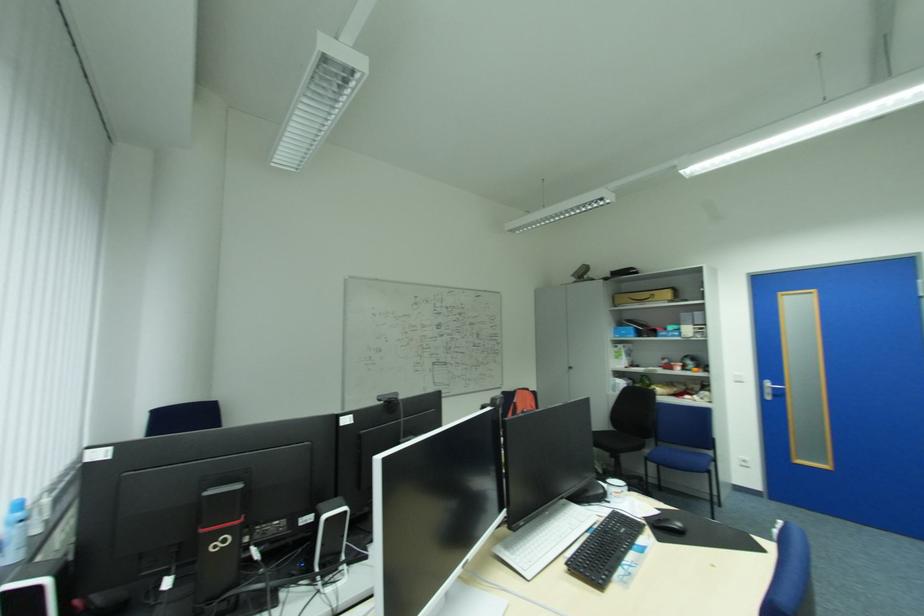
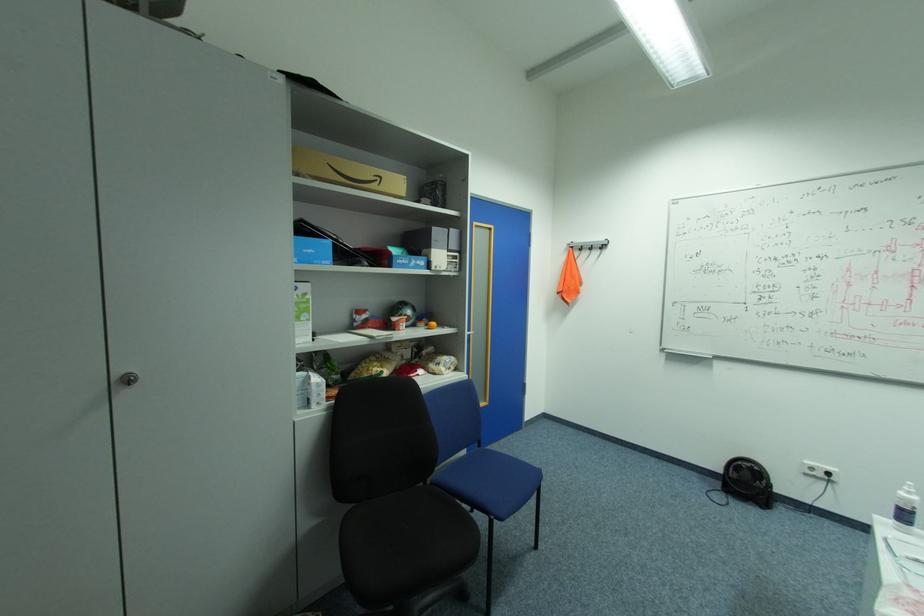
Where in the second image is the point corresponding to (577,368) from the first image?

(137, 379)